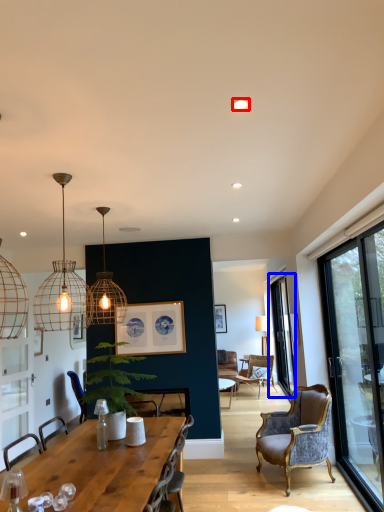
Question: Which point is closer to the camera, lighting (highlighted by a red box) or window (highlighted by a blue box)?

Choices:
 (A) lighting
 (B) window

Answer: (A)